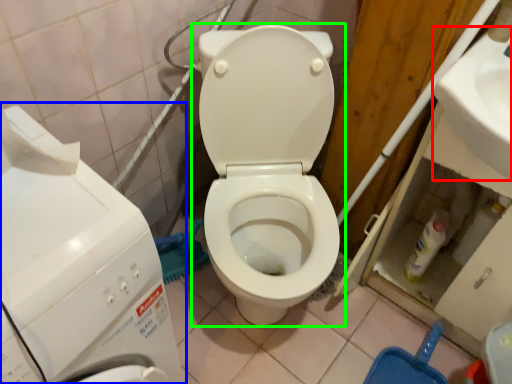
Question: Considering the real-world distances, which object is closest to sink (highlighted by a red box)? washing machine (highlighted by a blue box) or toilet (highlighted by a green box).

Choices:
 (A) washing machine
 (B) toilet

Answer: (B)